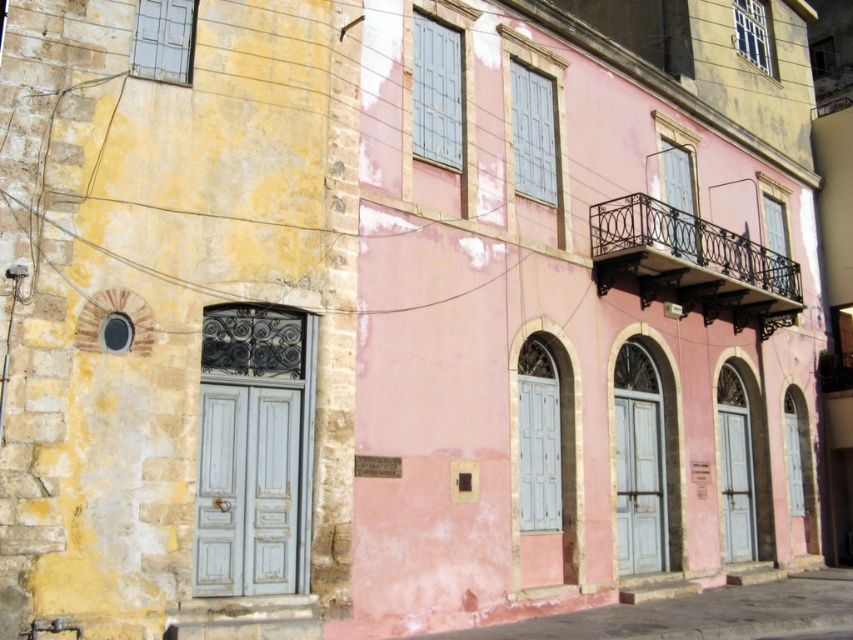
Question: From the image, what is the correct spatial relationship of distressed white door at left in relation to matte blue door at center?

Choices:
 (A) left
 (B) right

Answer: (A)

Question: Can you confirm if distressed white door at left is positioned above matte gray door at lower right?

Choices:
 (A) no
 (B) yes

Answer: (B)

Question: Among these objects, which one is farthest from the camera?

Choices:
 (A) matte blue door at center
 (B) distressed white door at left
 (C) matte gray door at lower right

Answer: (C)

Question: Can you confirm if distressed white door at left is positioned above matte blue door at center?

Choices:
 (A) no
 (B) yes

Answer: (B)

Question: Based on their relative distances, which object is nearer to the matte gray door at lower right?

Choices:
 (A) distressed white door at left
 (B) matte blue door at center

Answer: (B)

Question: Which object appears closest to the camera in this image?

Choices:
 (A) matte gray door at lower right
 (B) matte blue door at center

Answer: (B)